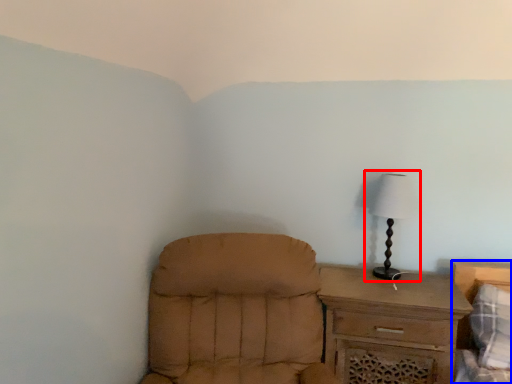
Question: Which object is further to the camera taking this photo, lamp (highlighted by a red box) or bed (highlighted by a blue box)?

Choices:
 (A) lamp
 (B) bed

Answer: (A)